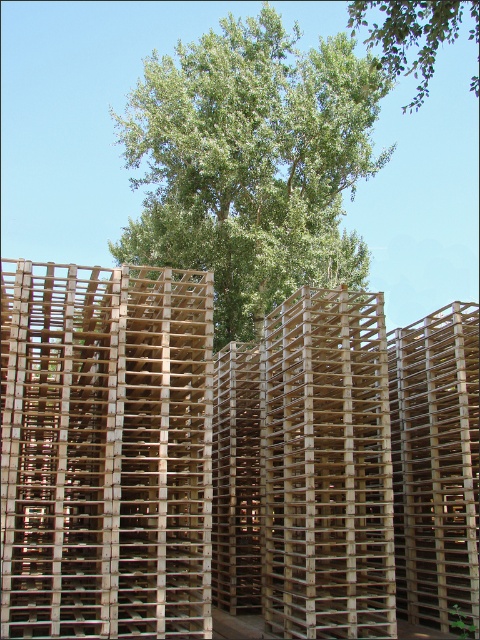
You are standing in a warehouse and see the natural wood pallets at center and the green leafy tree at center. Which object is positioned lower in the scene?

The natural wood pallets at center are positioned lower than the green leafy tree at center, as they are located below it in the scene.

You are standing in front of the image and want to know which object is wider between the natural wood pallets at center and the green leafy tree at upper center. Can you determine this?

The natural wood pallets at center is thinner than the green leafy tree at upper center, so the green leafy tree at upper center is wider.

Where are the natural wood pallets at center located in the image?

The natural wood pallets at center are located at point (230,460) in the image.